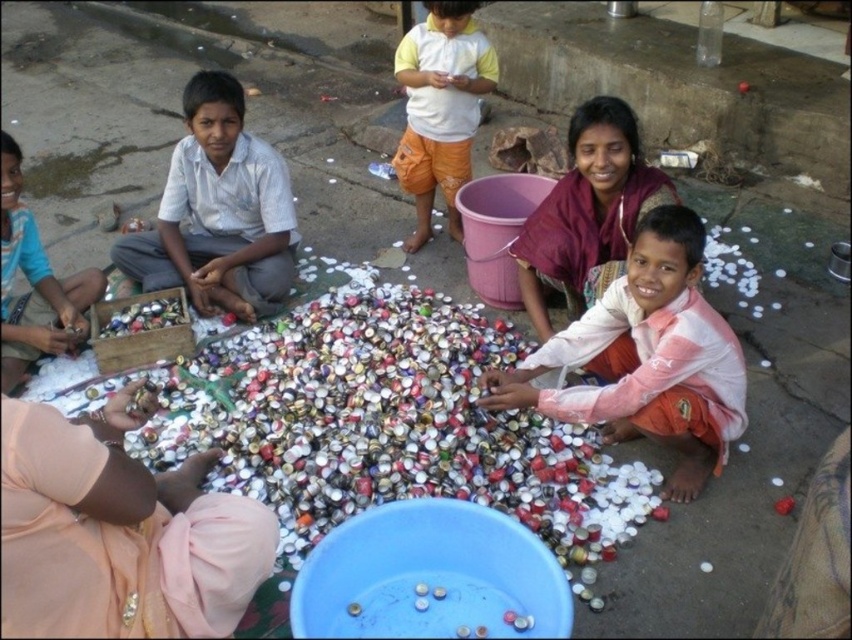
You are a photographer trying to capture a closeup of the pink fabric shirt at lower right without the matte blue shirt at lower left blocking the view. Is this possible given their positions?

The pink fabric shirt at lower right is positioned under the matte blue shirt at lower left, so it is blocked by the matte blue shirt at lower left. Therefore, capturing a clear closeup without obstruction would not be possible.

You are a delivery person who needs to place a package between the pink fabric shirt at lower right and the matte blue shirt at lower left. The package is 3 feet long. Can you fit it between them?

The distance between the pink fabric shirt at lower right and the matte blue shirt at lower left is 6.86 feet. Since the package is 3 feet long, it can fit comfortably between them as there is enough space.